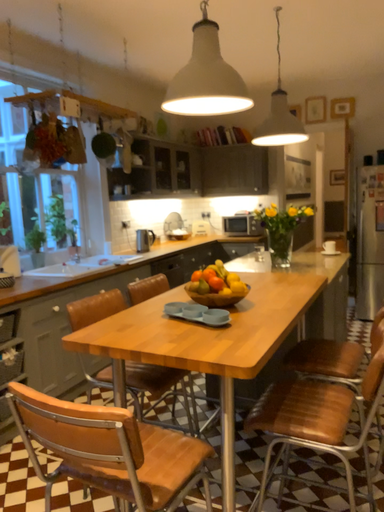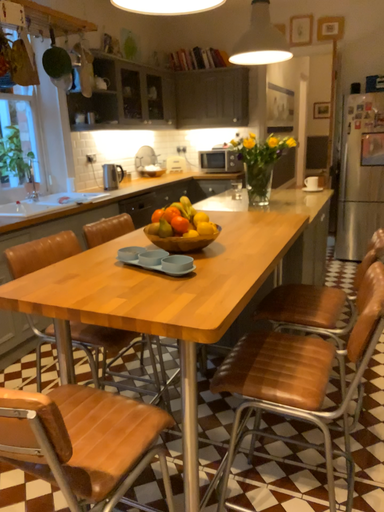
Question: How did the camera likely rotate when shooting the video?

Choices:
 (A) rotated upward
 (B) rotated downward

Answer: (B)